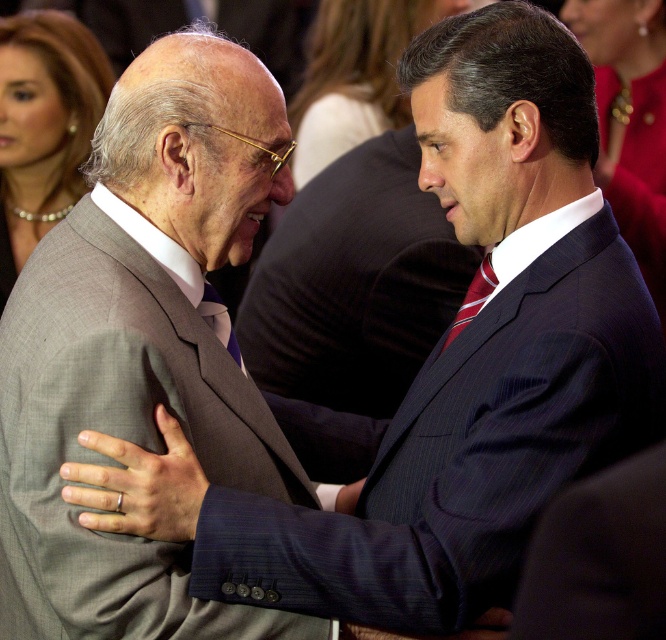
You are a tailor observing two men in formal attire. The first man wears a dark blue pinstripe suit at center, and the second has a striped silk tie at center. Which clothing item is taller?

The dark blue pinstripe suit at center is taller than the striped silk tie at center.

You are standing in front of the two men in the image. You need to determine which of the two points, point (450, 342) or point (214, 296), is closer to you. Which one is closer?

Point (450, 342) is closer to the viewer than point (214, 296).

You are a tailor observing two men in formal attire. You need to determine which tie, the striped silk tie at center or the blue striped tie at center, is wider. Based on the image, which one is wider?

The striped silk tie at center is wider than the blue striped tie at center according to the description.